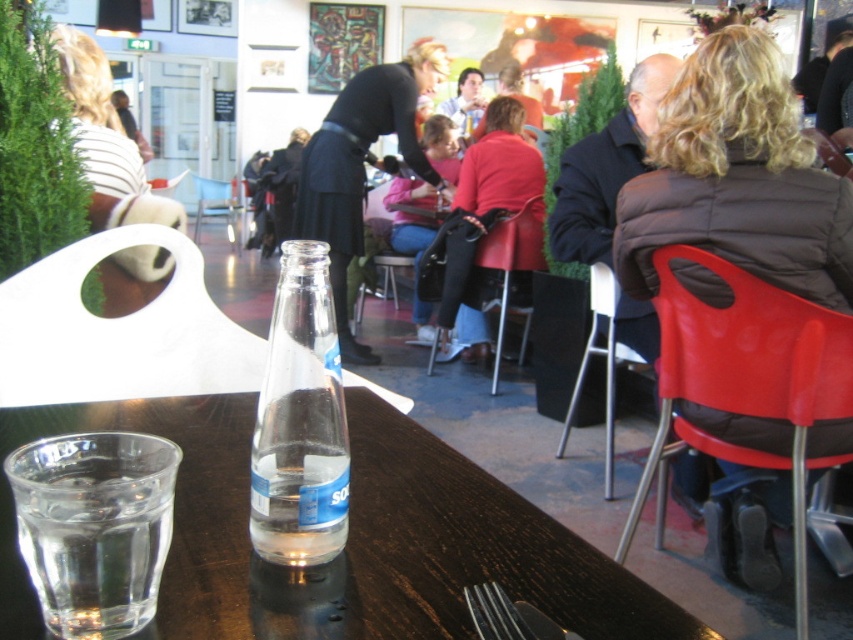
Question: Is red plastic chair at right below matte black bag at center?

Choices:
 (A) yes
 (B) no

Answer: (A)

Question: Which point is farther from the camera taking this photo?

Choices:
 (A) (467, 496)
 (B) (434, 348)
 (C) (840, 164)

Answer: (B)

Question: Which point is farther from the camera taking this photo?

Choices:
 (A) (647, 467)
 (B) (408, 77)
 (C) (366, 596)
 (D) (86, 48)

Answer: (B)

Question: Is red plastic chair at right to the right of polished metal fork at lower center from the viewer's perspective?

Choices:
 (A) no
 (B) yes

Answer: (B)

Question: Is red plastic chair at right thinner than metallic silver chair at center?

Choices:
 (A) no
 (B) yes

Answer: (B)

Question: Which object appears closest to the camera in this image?

Choices:
 (A) black leather jacket at center
 (B) polished metal fork at lower center
 (C) matte black bag at center

Answer: (B)